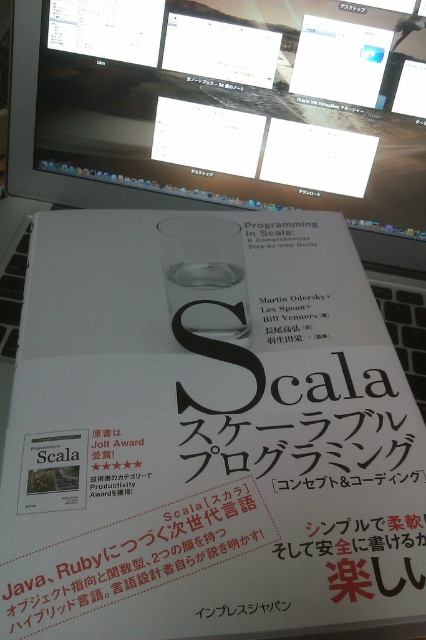
Question: Which of the following is the farthest from the observer?

Choices:
 (A) black plastic keyboard at lower left
 (B) transparent glass cup at center

Answer: (A)

Question: Which object is closer to the camera taking this photo?

Choices:
 (A) matte black monitor at upper center
 (B) black paper at center
 (C) transparent glass cup at center

Answer: (C)

Question: Can you confirm if matte black monitor at upper center is wider than transparent glass cup at center?

Choices:
 (A) yes
 (B) no

Answer: (A)

Question: Considering the real-world distances, which object is farthest from the black plastic keyboard at lower left?

Choices:
 (A) transparent glass cup at center
 (B) black paper at center
 (C) matte black monitor at upper center

Answer: (B)

Question: Does transparent glass cup at center appear over black paper at center?

Choices:
 (A) no
 (B) yes

Answer: (B)

Question: Can you confirm if matte black monitor at upper center is positioned to the left of transparent glass cup at center?

Choices:
 (A) no
 (B) yes

Answer: (A)